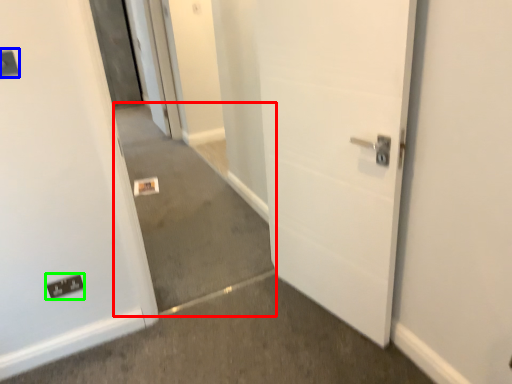
Question: Considering the real-world distances, which object is farthest from concrete (highlighted by a red box)? light switch (highlighted by a blue box) or electric outlet (highlighted by a green box)?

Choices:
 (A) light switch
 (B) electric outlet

Answer: (A)